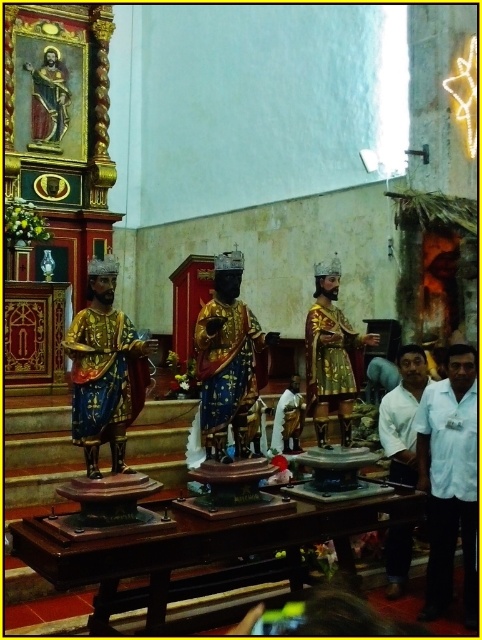
You are standing in front of the wooden table with the statues. You want to pick up the gold statue that is nearest to you. Which one should you choose between the gold textured statue at center and the gold metallic statue at center?

The gold textured statue at center is closer to the viewer, so you should pick up the gold textured statue at center.

In the scene shown: You are an art curator planning to move the gold metallic statue at center closer to the gold textured statue at center. If the minimum safe distance between any two statues in the exhibit is 3 meters, will this adjustment be possible without violating safety guidelines?

The distance between the gold textured statue at center and the gold metallic statue at center is currently 3.64 meters. Since the minimum safe distance required is 3 meters, moving them closer would still allow maintaining the safety guideline as long as they are not placed closer than 3 meters. However, the question is about moving the gold metallic statue closer to the gold textured statue. Since the current distance is already above the minimum, adjusting it to be closer but not below 3 meters is safe.

You are an art conservator examining the statues in the church. You need to determine the placement of the gold metallic statue at left and the gold textured statue at center. Which statue is placed higher than the other?

The gold metallic statue at left is positioned over the gold textured statue at center, meaning it is placed higher than the other.